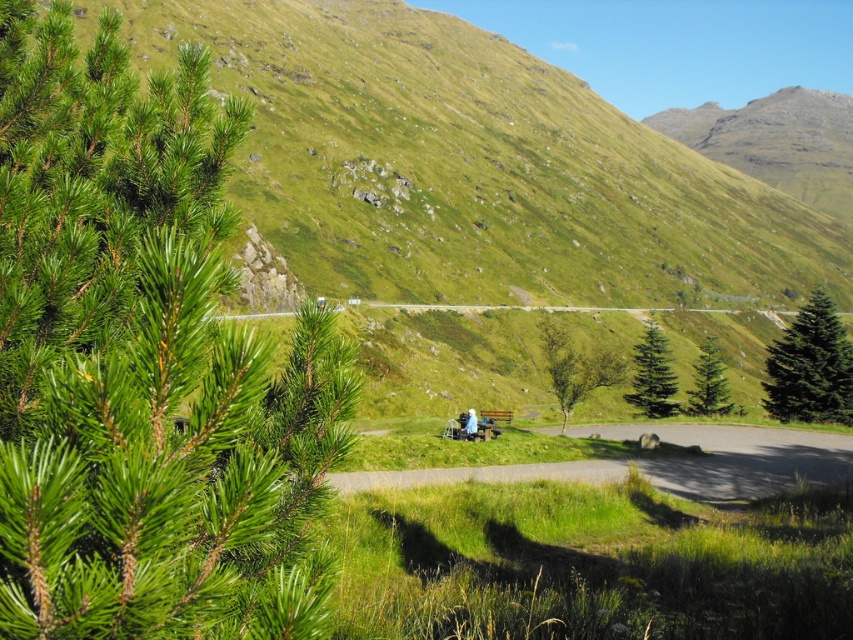
You are planning to walk along the gravel path at center and the light blue fabric at center. Which one is higher up in the scene?

The gravel path at center is located above the light blue fabric at center, so the gravel path at center is higher up in the scene.